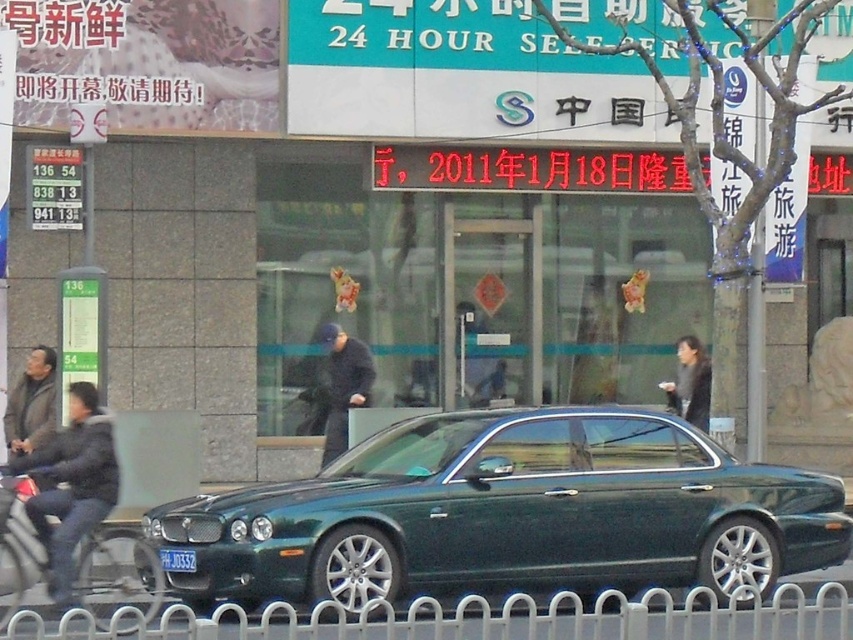
You are a fashion designer observing pedestrians on the sidewalk. You notice two jackets, the dark gray jacket at left and the black matte jacket at center. Which jacket appears to be wider?

The dark gray jacket at left appears wider than the black matte jacket at center because its width is larger.

You are a delivery robot that needs to navigate from the sidewalk to the building entrance. The robot is 1.2 meters wide. Is there enough space between the white metal fence at lower center and the dark gray jacket at left for the robot to pass through?

The distance between the white metal fence at lower center and the dark gray jacket at left is 3.92 meters. Since the robot is 1.2 meters wide, there is sufficient space for it to pass through.